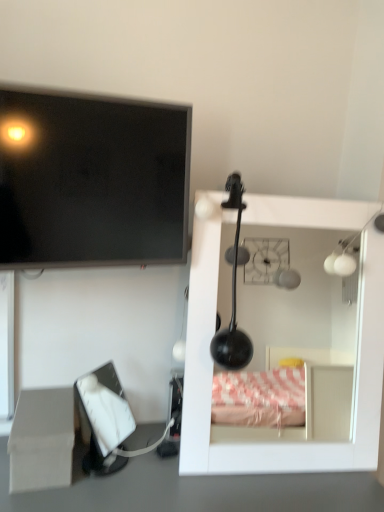
Question: Considering the relative sizes of beige cardboard box at lower left and white glossy mirror at upper right in the image provided, is beige cardboard box at lower left bigger than white glossy mirror at upper right?

Choices:
 (A) no
 (B) yes

Answer: (A)

Question: From a real-world perspective, does beige cardboard box at lower left stand above white glossy mirror at upper right?

Choices:
 (A) no
 (B) yes

Answer: (A)

Question: From the image's perspective, is beige cardboard box at lower left on top of white glossy mirror at upper right?

Choices:
 (A) yes
 (B) no

Answer: (B)

Question: Is beige cardboard box at lower left positioned behind white glossy mirror at upper right?

Choices:
 (A) no
 (B) yes

Answer: (A)

Question: Is beige cardboard box at lower left shorter than white glossy mirror at upper right?

Choices:
 (A) no
 (B) yes

Answer: (B)

Question: Is beige cardboard box at lower left far away from white glossy mirror at upper right?

Choices:
 (A) no
 (B) yes

Answer: (B)

Question: Can you confirm if white matte tissue box at lower left is bigger than beige cardboard box at lower left?

Choices:
 (A) no
 (B) yes

Answer: (B)

Question: Is white matte tissue box at lower left smaller than beige cardboard box at lower left?

Choices:
 (A) no
 (B) yes

Answer: (A)

Question: Considering the relative positions of white matte tissue box at lower left and beige cardboard box at lower left in the image provided, is white matte tissue box at lower left to the left of beige cardboard box at lower left from the viewer's perspective?

Choices:
 (A) yes
 (B) no

Answer: (B)

Question: From the image's perspective, does white matte tissue box at lower left appear higher than beige cardboard box at lower left?

Choices:
 (A) no
 (B) yes

Answer: (B)

Question: Can you see white matte tissue box at lower left touching beige cardboard box at lower left?

Choices:
 (A) yes
 (B) no

Answer: (B)

Question: Considering the relative positions of white matte tissue box at lower left and beige cardboard box at lower left in the image provided, is white matte tissue box at lower left to the right of beige cardboard box at lower left from the viewer's perspective?

Choices:
 (A) no
 (B) yes

Answer: (B)

Question: Does white glossy mirror at upper right appear on the right side of beige cardboard box at lower left?

Choices:
 (A) yes
 (B) no

Answer: (A)